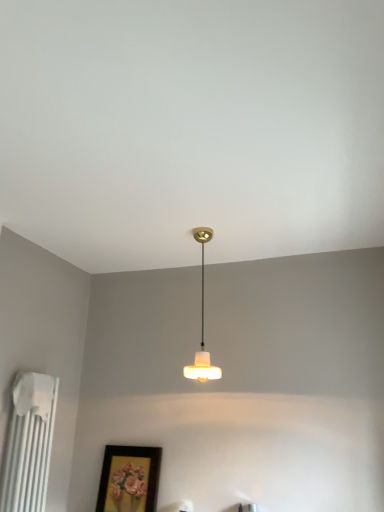
Question: In the image, is white matte radiator at left positioned in front of or behind white frosted glass lampshade at center?

Choices:
 (A) behind
 (B) front

Answer: (B)

Question: Considering the positions of white matte radiator at left and white frosted glass lampshade at center in the image, is white matte radiator at left wider or thinner than white frosted glass lampshade at center?

Choices:
 (A) thin
 (B) wide

Answer: (A)

Question: Estimate the real-world distances between objects in this image. Which object is closer to the matte gold picture frame at lower center?

Choices:
 (A) white matte radiator at left
 (B) white frosted glass lampshade at center

Answer: (A)

Question: Considering the real-world distances, which object is closest to the white matte radiator at left?

Choices:
 (A) white frosted glass lampshade at center
 (B) matte gold picture frame at lower center

Answer: (B)